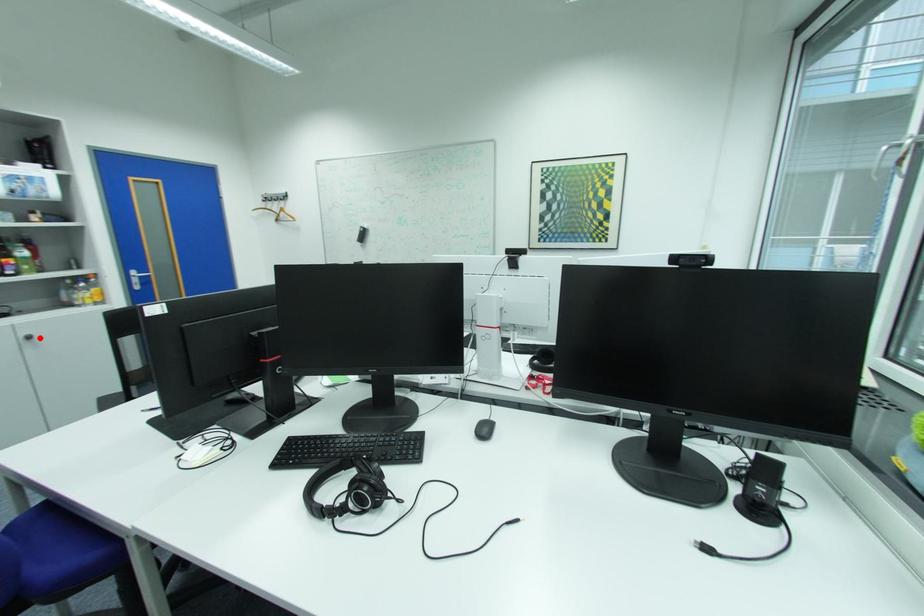
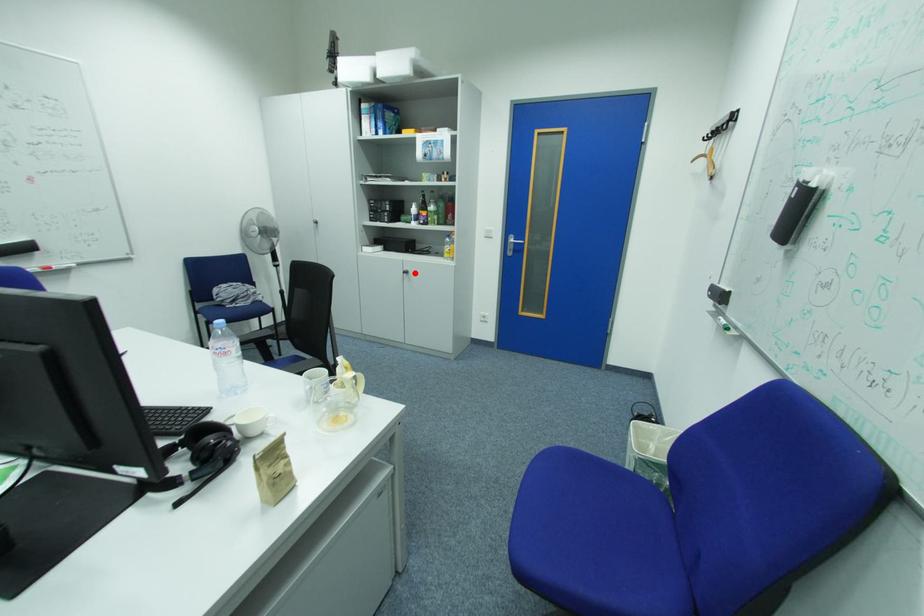
I am providing you with two images of the same scene from different viewpoints. A red point is marked on the first image and another point is marked on the second image. Does the point marked in image1 correspond to the same location as the one in image2?

Yes